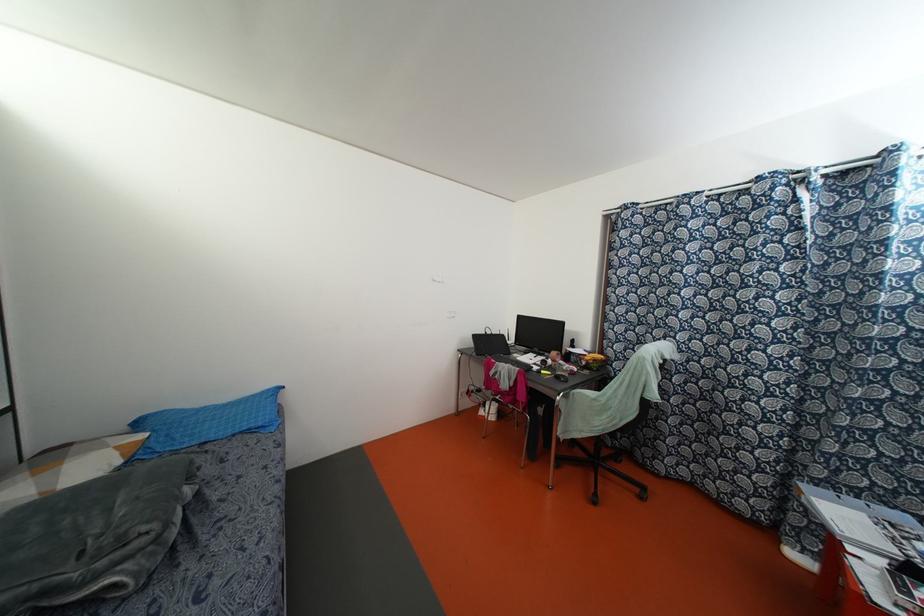
What do you see at coordinates (576, 394) in the screenshot? I see `the chair armrest` at bounding box center [576, 394].